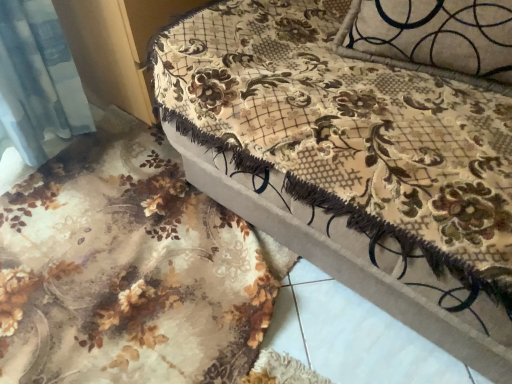
What is the approximate width of velvet floral bed frame at upper right?

It is 37.32 inches.

Find the location of a particular element. The image size is (512, 384). velvet floral bed frame at upper right is located at coordinates (128, 268).

What do you see at coordinates (128, 268) in the screenshot?
I see `velvet floral bed frame at upper right` at bounding box center [128, 268].

The image size is (512, 384). What do you see at coordinates (361, 148) in the screenshot?
I see `velvet floral-patterned ottoman at center` at bounding box center [361, 148].

The image size is (512, 384). In order to click on velvet floral-patterned ottoman at center in this screenshot , I will do `click(361, 148)`.

Where is `velvet floral bed frame at upper right`? Image resolution: width=512 pixels, height=384 pixels. velvet floral bed frame at upper right is located at coordinates (128, 268).

Considering the relative positions of velvet floral-patterned ottoman at center and velvet floral bed frame at upper right in the image provided, is velvet floral-patterned ottoman at center to the right of velvet floral bed frame at upper right from the viewer's perspective?

Yes.

Consider the image. Is velvet floral-patterned ottoman at center in front of velvet floral bed frame at upper right?

Yes, the depth of velvet floral-patterned ottoman at center is less than that of velvet floral bed frame at upper right.

Is point (284, 80) positioned after point (205, 324)?

No, it is in front of (205, 324).

From the image's perspective, which is above, velvet floral-patterned ottoman at center or velvet floral bed frame at upper right?

From the image's view, velvet floral-patterned ottoman at center is above.

From a real-world perspective, is velvet floral-patterned ottoman at center below velvet floral bed frame at upper right?

Incorrect, from a real-world perspective, velvet floral-patterned ottoman at center is higher than velvet floral bed frame at upper right.

In terms of width, does velvet floral-patterned ottoman at center look wider or thinner when compared to velvet floral bed frame at upper right?

Clearly, velvet floral-patterned ottoman at center has more width compared to velvet floral bed frame at upper right.

Considering the sizes of objects velvet floral-patterned ottoman at center and velvet floral bed frame at upper right in the image provided, who is taller, velvet floral-patterned ottoman at center or velvet floral bed frame at upper right?

velvet floral-patterned ottoman at center is taller.

In the scene shown: Does velvet floral-patterned ottoman at center have a smaller size compared to velvet floral bed frame at upper right?

No, velvet floral-patterned ottoman at center is not smaller than velvet floral bed frame at upper right.

Is velvet floral-patterned ottoman at center located outside velvet floral bed frame at upper right?

That's correct, velvet floral-patterned ottoman at center is outside of velvet floral bed frame at upper right.

Is velvet floral-patterned ottoman at center placed right next to velvet floral bed frame at upper right?

velvet floral-patterned ottoman at center and velvet floral bed frame at upper right are not in contact.

Is velvet floral-patterned ottoman at center aimed at velvet floral bed frame at upper right?

Yes, velvet floral-patterned ottoman at center is oriented towards velvet floral bed frame at upper right.

Can you tell me how much velvet floral-patterned ottoman at center and velvet floral bed frame at upper right differ in facing direction?

velvet floral-patterned ottoman at center and velvet floral bed frame at upper right are facing 95.1 degrees away from each other.

In the image, there is a velvet floral bed frame at upper right. Where is `furniture above it (from the image's perspective)`? This screenshot has width=512, height=384. furniture above it (from the image's perspective) is located at coordinates (361, 148).

Is velvet floral bed frame at upper right to the right of velvet floral-patterned ottoman at center from the viewer's perspective?

No, velvet floral bed frame at upper right is not to the right of velvet floral-patterned ottoman at center.

Does velvet floral bed frame at upper right come in front of velvet floral-patterned ottoman at center?

No, velvet floral bed frame at upper right is further to the viewer.

From the picture: Which point is more forward, (x=217, y=284) or (x=217, y=80)?

Positioned in front is point (x=217, y=80).

In the scene shown: From the image's perspective, is velvet floral bed frame at upper right on top of velvet floral-patterned ottoman at center?

No, from the image's perspective, velvet floral bed frame at upper right is not on top of velvet floral-patterned ottoman at center.

From a real-world perspective, is velvet floral bed frame at upper right beneath velvet floral-patterned ottoman at center?

Indeed, from a real-world perspective, velvet floral bed frame at upper right is positioned beneath velvet floral-patterned ottoman at center.

Is velvet floral bed frame at upper right thinner than velvet floral-patterned ottoman at center?

Correct, the width of velvet floral bed frame at upper right is less than that of velvet floral-patterned ottoman at center.

From their relative heights in the image, would you say velvet floral bed frame at upper right is taller or shorter than velvet floral-patterned ottoman at center?

In the image, velvet floral bed frame at upper right appears to be shorter than velvet floral-patterned ottoman at center.

Is velvet floral bed frame at upper right bigger or smaller than velvet floral-patterned ottoman at center?

velvet floral bed frame at upper right is smaller than velvet floral-patterned ottoman at center.

Is velvet floral-patterned ottoman at center located within velvet floral bed frame at upper right?

That's incorrect, velvet floral-patterned ottoman at center is not inside velvet floral bed frame at upper right.

Is velvet floral bed frame at upper right next to velvet floral-patterned ottoman at center?

velvet floral bed frame at upper right is not next to velvet floral-patterned ottoman at center, and they're not touching.

Could you tell me if velvet floral bed frame at upper right is turned towards velvet floral-patterned ottoman at center?

No.

How different are the orientations of velvet floral bed frame at upper right and velvet floral-patterned ottoman at center in degrees?

95.1 degrees.

At what (x,y) coordinates should I click in order to perform the action: click on bed frame below the velvet floral-patterned ottoman at center (from a real-world perspective). Please return your answer as a coordinate pair (x, y). Looking at the image, I should click on point(128,268).

Identify the location of bed frame located underneath the velvet floral-patterned ottoman at center (from a real-world perspective). Image resolution: width=512 pixels, height=384 pixels. (128, 268).

Locate an element on the screen. This screenshot has height=384, width=512. bed frame below the velvet floral-patterned ottoman at center (from the image's perspective) is located at coordinates (128, 268).